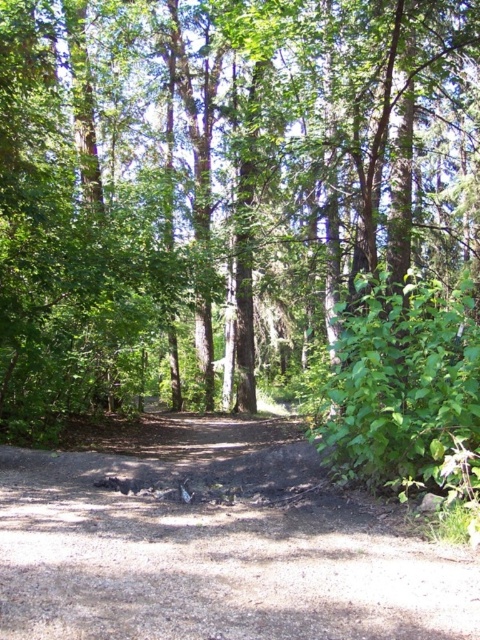
You are a hiker planning to walk along the brown dirt track at center. You notice a green leafy tree at center nearby. Which one is bigger in size?

The green leafy tree at center is larger in size than the brown dirt track at center.

You are a hiker trying to navigate a narrow path. You see the green leafy tree at center and the brown dirt track at center. Which one is wider?

The green leafy tree at center is wider than the brown dirt track at center.